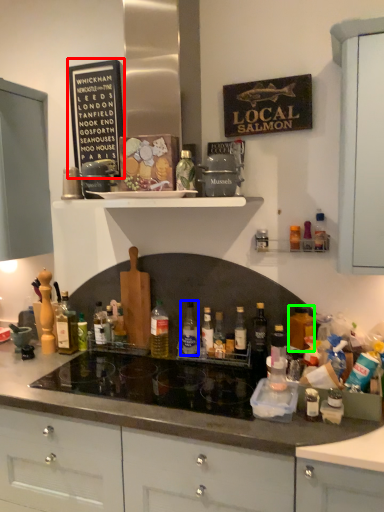
Question: Considering the real-world distances, which object is closest to bulletin board (highlighted by a red box)? bottle (highlighted by a blue box) or bottle (highlighted by a green box).

Choices:
 (A) bottle
 (B) bottle

Answer: (A)